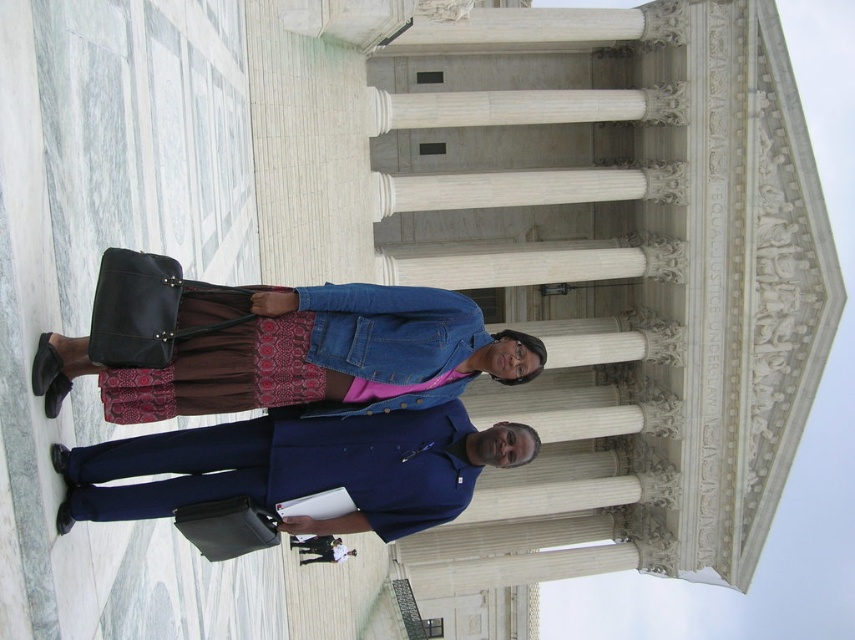
Question: Which point appears farthest from the camera in this image?

Choices:
 (A) (458, 544)
 (B) (373, 305)

Answer: (A)

Question: Considering the relative positions of white marble columns at center and blue woolen suit at center in the image provided, where is white marble columns at center located with respect to blue woolen suit at center?

Choices:
 (A) right
 (B) left

Answer: (A)

Question: Does denim jacket at center appear on the right side of dark blue shirt at center?

Choices:
 (A) no
 (B) yes

Answer: (B)

Question: Which of the following is the closest to the observer?

Choices:
 (A) blue woolen suit at center
 (B) denim jacket at center
 (C) dark blue shirt at center
 (D) white marble columns at center

Answer: (B)

Question: Which point is closer to the camera?

Choices:
 (A) dark blue shirt at center
 (B) denim jacket at center
 (C) blue woolen suit at center

Answer: (B)

Question: Where is blue woolen suit at center located in relation to dark blue shirt at center in the image?

Choices:
 (A) below
 (B) above

Answer: (B)